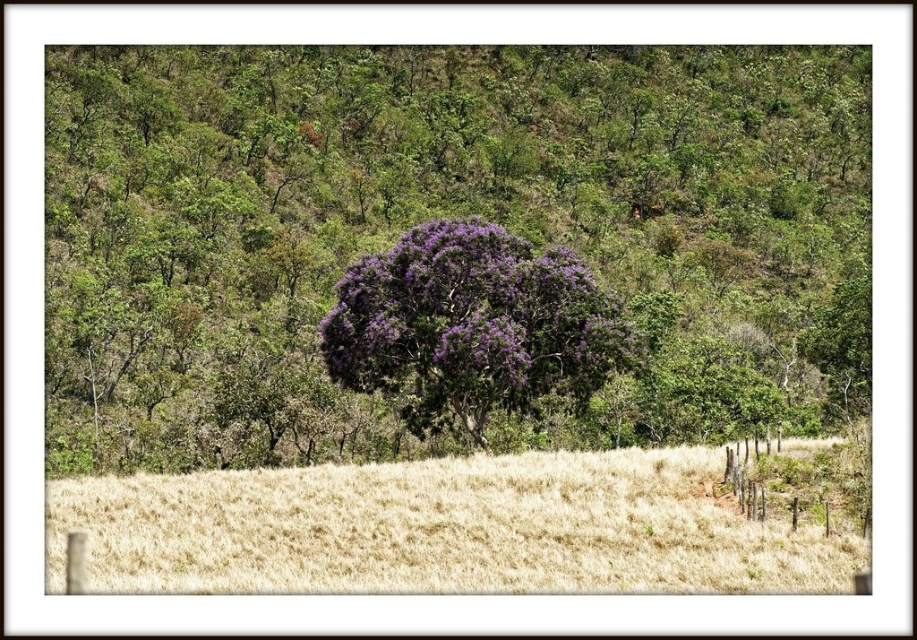
Looking at this image, how distant is purple leafy tree at center from dry straw field at lower center?

purple leafy tree at center is 36.79 meters away from dry straw field at lower center.

Describe the element at coordinates (447, 248) in the screenshot. Image resolution: width=917 pixels, height=640 pixels. I see `purple leafy tree at center` at that location.

You are a GUI agent. You are given a task and a screenshot of the screen. Output one action in this format:
    pyautogui.click(x=<x>, y=<y>)
    Task: Click on the purple leafy tree at center
    This screenshot has height=640, width=917.
    Given the screenshot: What is the action you would take?
    pyautogui.click(x=447, y=248)

Who is positioned more to the left, dry straw field at lower center or purple leafy bush at center?

From the viewer's perspective, dry straw field at lower center appears more on the left side.

Does dry straw field at lower center appear on the left side of purple leafy bush at center?

Correct, you'll find dry straw field at lower center to the left of purple leafy bush at center.

Which is in front, point (286, 564) or point (600, 321)?

Point (286, 564) is more forward.

In order to click on dry straw field at lower center in this screenshot , I will do `click(445, 529)`.

Is purple leafy tree at center wider than purple leafy bush at center?

Indeed, purple leafy tree at center has a greater width compared to purple leafy bush at center.

Does point (459, 280) come behind point (495, 227)?

No, it is in front of (495, 227).

Who is more distant from viewer, (75, 195) or (341, 380)?

The point (75, 195) is behind.

Image resolution: width=917 pixels, height=640 pixels. Identify the location of purple leafy tree at center. point(447,248).